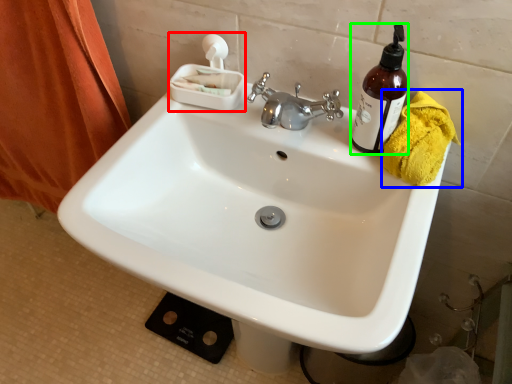
Question: Which object is positioned farthest from tissue (highlighted by a red box)? Select from bath towel (highlighted by a blue box) and bottle (highlighted by a green box).

Choices:
 (A) bath towel
 (B) bottle

Answer: (A)